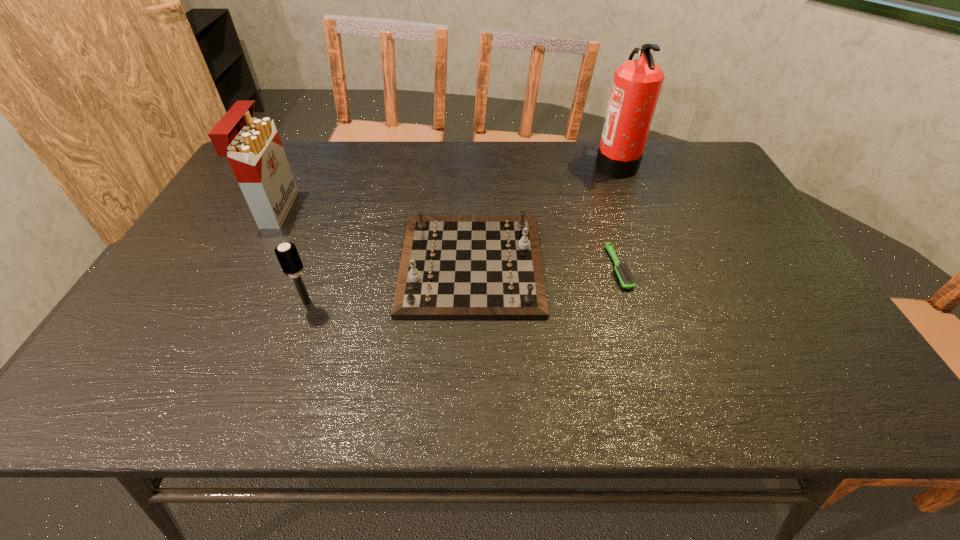
The image size is (960, 540). Find the location of `vacant space located on the front side of the tallest object`. vacant space located on the front side of the tallest object is located at coordinates (567, 165).

The width and height of the screenshot is (960, 540). Identify the location of blank space located on the front side of the tallest object. (521, 165).

Identify the location of vacant space located on the front side of the tallest object. The width and height of the screenshot is (960, 540). (559, 165).

I want to click on free space located with the lid open on the fourth shortest object, so click(373, 209).

At what (x,y) coordinates should I click in order to perform the action: click on free space located on the back of the nearer hairbrush. Please return your answer as a coordinate pair (x, y). Looking at the image, I should click on (339, 214).

You are a GUI agent. You are given a task and a screenshot of the screen. Output one action in this format:
    pyautogui.click(x=<x>, y=<y>)
    Task: Click on the free spot located 0.200m on the board of the fourth tallest object
    
    Given the screenshot: What is the action you would take?
    pyautogui.click(x=621, y=264)

This screenshot has width=960, height=540. I want to click on vacant region located 0.130m on the front of the farther hairbrush, so click(x=639, y=336).

I want to click on object present at the far edge, so click(x=637, y=83).

Find the location of a particular element. Image resolution: width=960 pixels, height=540 pixels. object at the left edge is located at coordinates (252, 145).

Locate an element on the screen. The image size is (960, 540). vacant space at the far edge of the desktop is located at coordinates (659, 180).